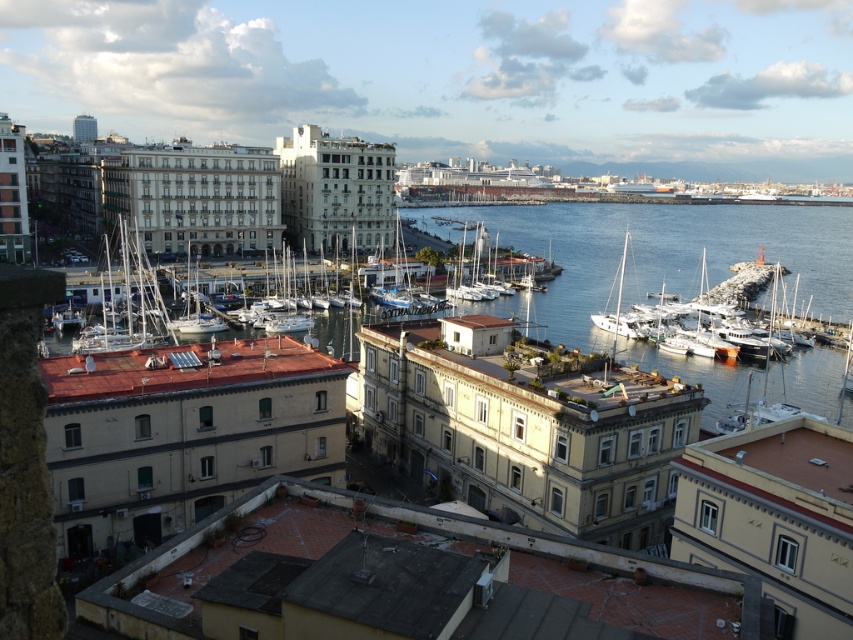
You are a photographer planning to capture the white matte sailboat at center and the white matte boats at lower right in the same frame. Based on their sizes in the image, which one would appear larger in your photo?

The white matte sailboat at center would appear larger in the photo because it is much taller than the white matte boats at lower right.